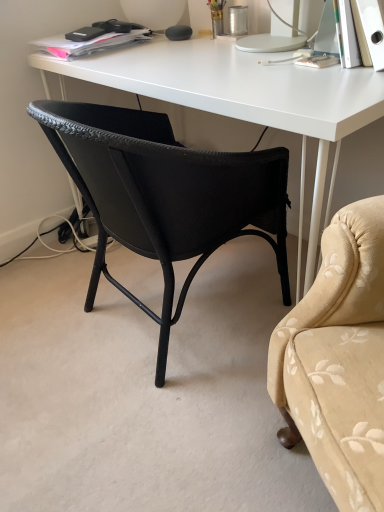
Identify the location of vacant space to the right of matte black charger at upper left. The width and height of the screenshot is (384, 512). (168, 42).